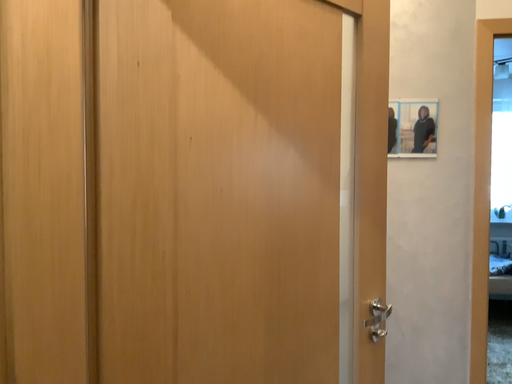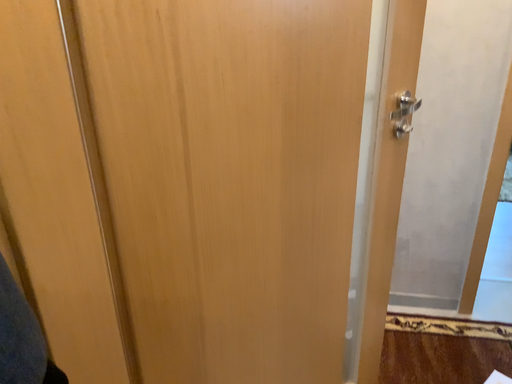
Question: How did the camera likely rotate when shooting the video?

Choices:
 (A) rotated upward
 (B) rotated downward

Answer: (B)